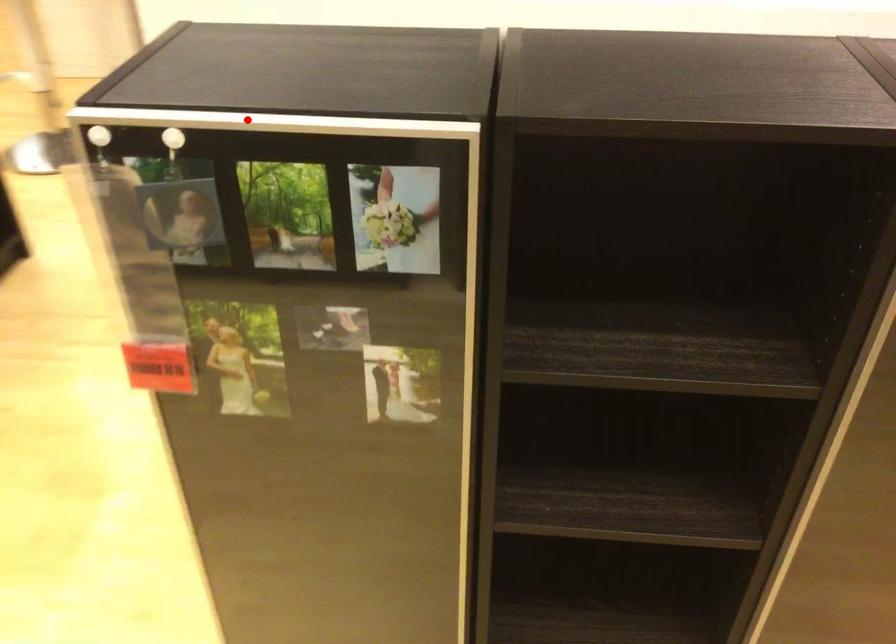
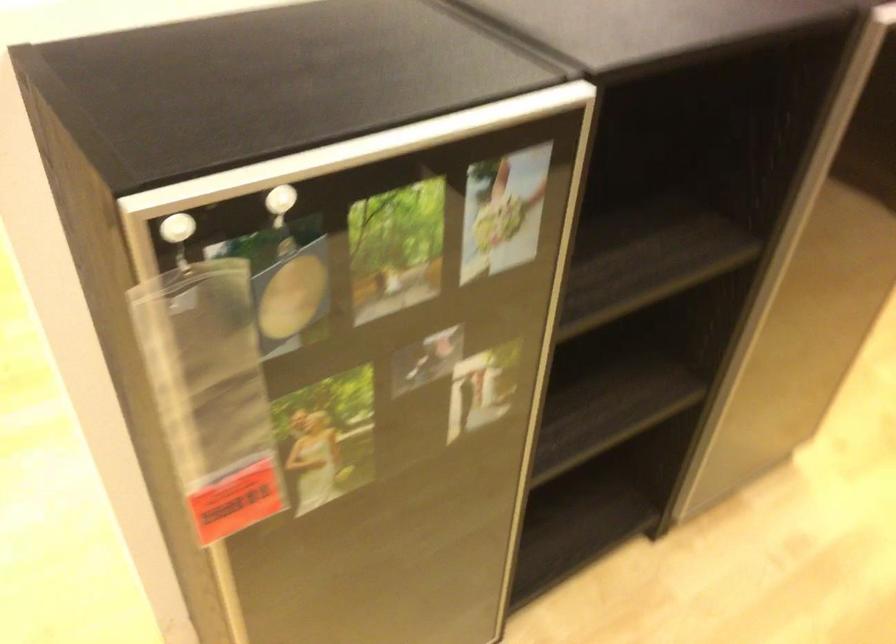
Question: I am providing you with two images of the same scene from different viewpoints. In image1, a red point is highlighted. Considering the same 3D point in image2, which of the following is correct?

Choices:
 (A) It is closer
 (B) It is farther

Answer: (A)